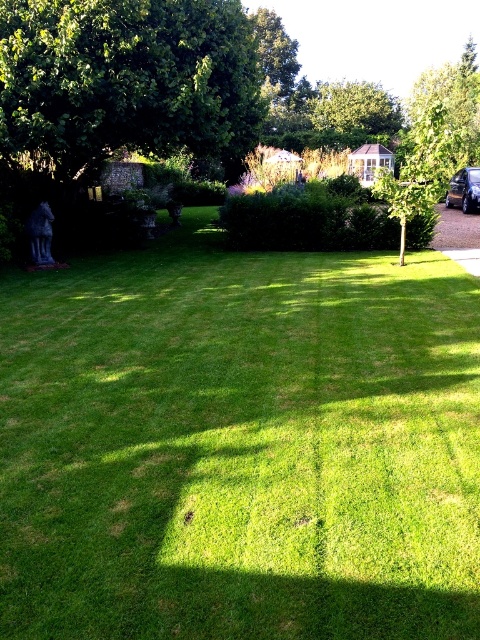
You are standing at the center of the garden and see two points marked in the image. Which point is closer to you? The points are labeled as point (90, 435) and point (50, 33).

Point (90, 435) is in front of point (50, 33), so it is closer to you.

You are a gardener planning to plant a new tree in this garden. You have two options for locations based on the existing trees. The first location is where the green leafy tree at center is currently growing, and the second is where the green leafy tree at upper center is. Which location would allow for a tree with a wider canopy? Please base your answer on the existing trees in the scene.

The green leafy tree at center might be wider than green leafy tree at upper center, so planting a new tree in the location of the green leafy tree at center would allow for a wider canopy.